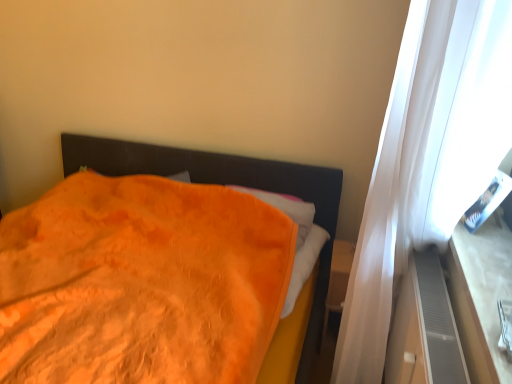
Question: Is orange soft blanket at left taller or shorter than gray textured dresser at right?

Choices:
 (A) tall
 (B) short

Answer: (A)

Question: Is orange soft blanket at left bigger or smaller than gray textured dresser at right?

Choices:
 (A) big
 (B) small

Answer: (A)

Question: Considering the real-world distances, which object is farthest from the gray textured dresser at right?

Choices:
 (A) orange soft blanket at left
 (B) wooden at right

Answer: (A)

Question: Considering the real-world distances, which object is farthest from the gray textured dresser at right?

Choices:
 (A) wooden at right
 (B) orange soft blanket at left

Answer: (B)